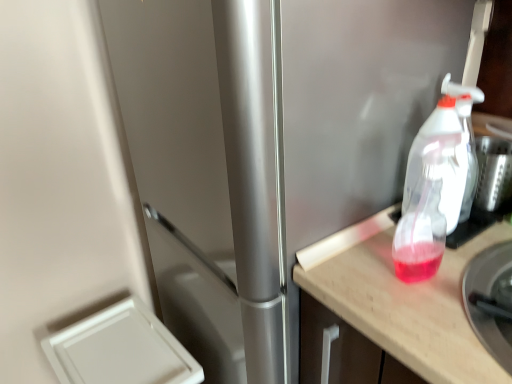
Where is `free spot to the right of translucent plastic spray bottle at right`? free spot to the right of translucent plastic spray bottle at right is located at coordinates (472, 257).